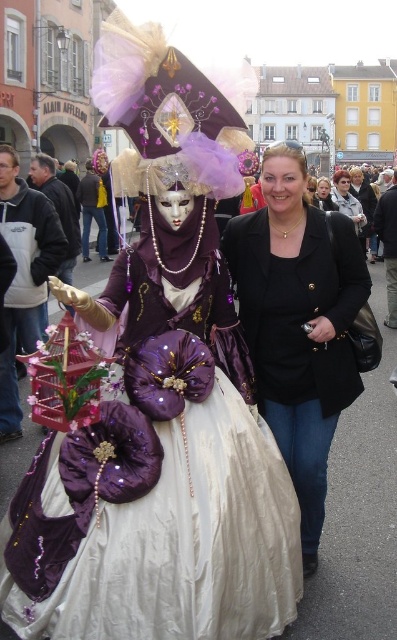
Please provide the coordinates of the purple satin dress at center in the image.

The purple satin dress at center is located at coordinates point (158, 484).

You are a photographer trying to capture both the black matte blazer at center and the black matte jacket at center in a single frame. Given the camera you have can only focus on objects within 30 meters, will you be able to capture both in focus?

The distance between the black matte blazer at center and the black matte jacket at center is 34.09 meters, which exceeds the camera focus range of 30 meters. Therefore, you cannot capture both in focus.